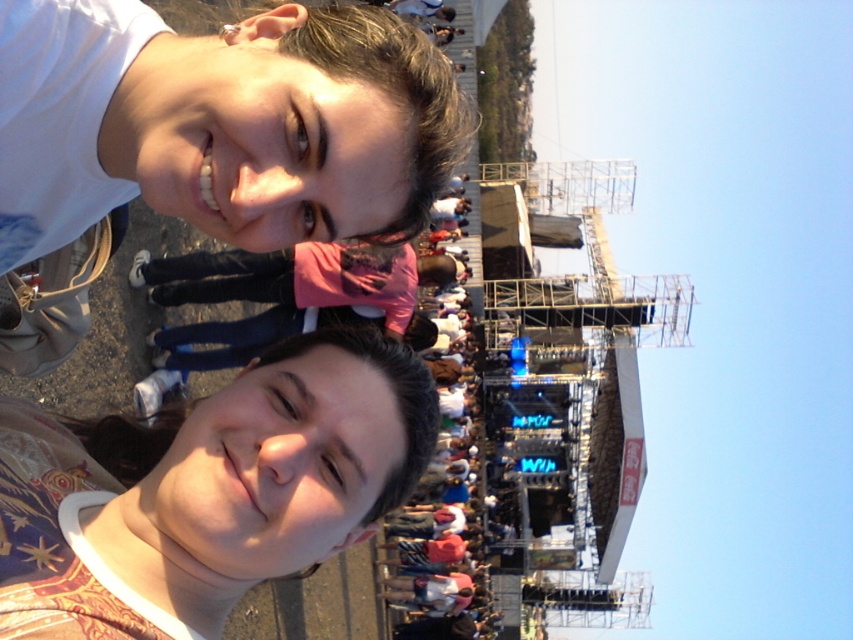
You are a photographer trying to adjust your camera focus. You notice two subjects in your viewfinder. The first is a matte white face at upper left, and the second is a matte floral shirt at lower left. Which subject should you focus on if you want to capture the taller object?

The matte floral shirt at lower left is taller than the matte white face at upper left, so you should focus on the matte floral shirt at lower left to capture the taller object.

In the image of the outdoor event, there is a matte white face at upper left. What are the coordinates of its position?

The coordinates of the matte white face at upper left are at point (219, 124).

You are taking a photo at an outdoor event and notice two points in the image labeled as point (x=38, y=150) and point (x=15, y=433). Based on their positions, which point is nearer to the camera?

Point (x=38, y=150) is closer to the camera than point (x=15, y=433).